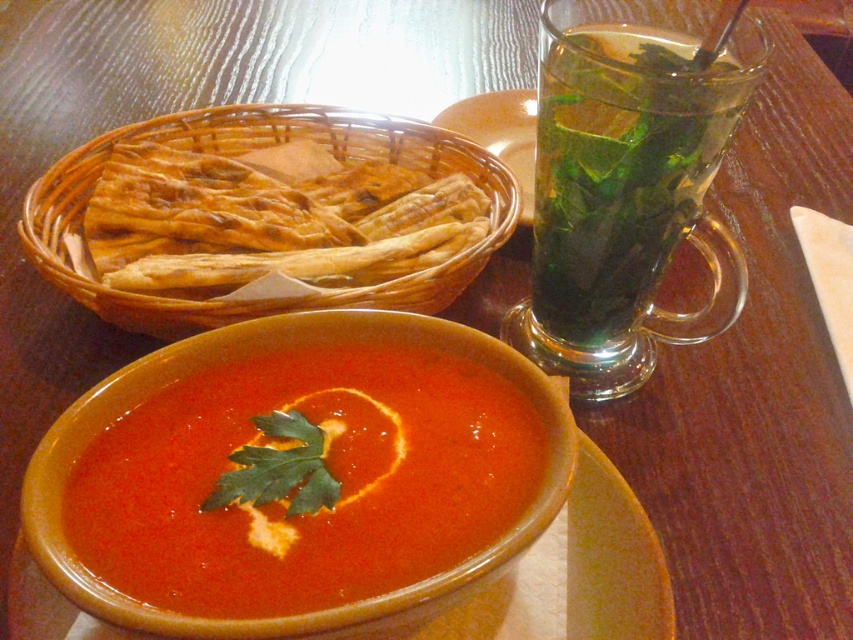
Is smooth matte tomato soup at center above green leafy liquid at upper right?

No.

Is smooth matte tomato soup at center taller than green leafy liquid at upper right?

Incorrect, smooth matte tomato soup at center's height is not larger of green leafy liquid at upper right's.

What do you see at coordinates (303, 480) in the screenshot?
I see `smooth matte tomato soup at center` at bounding box center [303, 480].

Where is `smooth matte tomato soup at center`? The height and width of the screenshot is (640, 853). smooth matte tomato soup at center is located at coordinates (303, 480).

Is smooth matte tomato soup at center positioned at the back of golden brown wicker basket at upper left?

No.

Who is positioned more to the right, smooth matte tomato soup at center or golden brown wicker basket at upper left?

From the viewer's perspective, smooth matte tomato soup at center appears more on the right side.

Image resolution: width=853 pixels, height=640 pixels. Find the location of `smooth matte tomato soup at center`. smooth matte tomato soup at center is located at coordinates (303, 480).

Locate an element on the screen. The height and width of the screenshot is (640, 853). smooth matte tomato soup at center is located at coordinates (303, 480).

Does green leafy liquid at upper right have a lesser height compared to golden brown wicker basket at upper left?

No, green leafy liquid at upper right is not shorter than golden brown wicker basket at upper left.

Is green leafy liquid at upper right thinner than golden brown wicker basket at upper left?

Indeed, green leafy liquid at upper right has a lesser width compared to golden brown wicker basket at upper left.

Is point (561, 93) closer to camera compared to point (355, 189)?

Yes.

At what (x,y) coordinates should I click in order to perform the action: click on green leafy liquid at upper right. Please return your answer as a coordinate pair (x, y). Image resolution: width=853 pixels, height=640 pixels. Looking at the image, I should click on (630, 172).